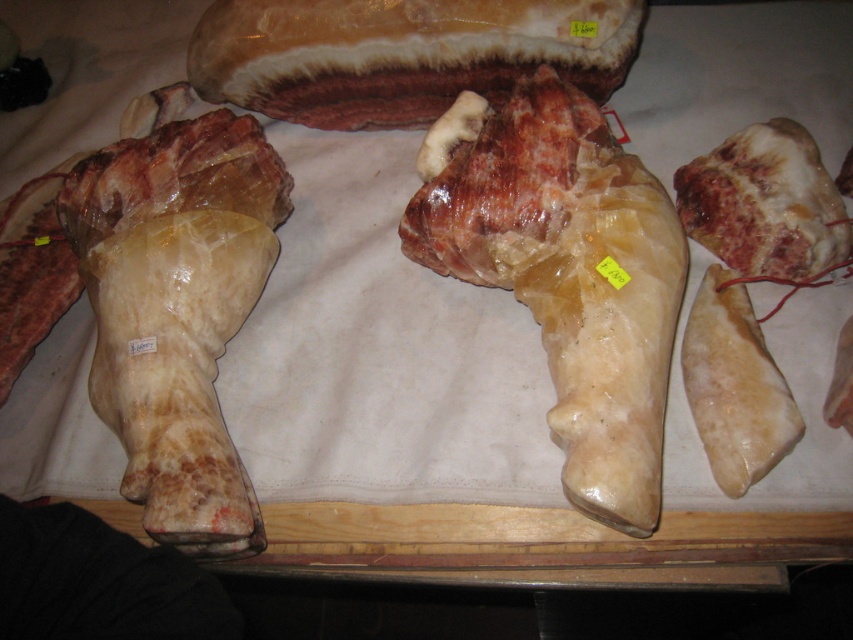
Who is lower down, fatty white meat at right or yellowish-fat ham at right?

yellowish-fat ham at right

Which is above, fatty white meat at right or yellowish-fat ham at right?

Positioned higher is fatty white meat at right.

In order to click on fatty white meat at right in this screenshot , I will do click(764, 204).

Between point (515, 234) and point (193, 77), which one is positioned in front?

Point (515, 234) is more forward.

From the picture: Does translucent gelatinous leg at center have a smaller size compared to glossy white meat at upper center?

Incorrect, translucent gelatinous leg at center is not smaller in size than glossy white meat at upper center.

Between point (444, 211) and point (480, 33), which one is positioned behind?

Point (480, 33)

Locate an element on the screen. The height and width of the screenshot is (640, 853). translucent gelatinous leg at center is located at coordinates (570, 278).

Is point (498, 115) less distant than point (752, 451)?

No.

Does translucent gelatinous leg at center have a lesser width compared to yellowish-fat ham at right?

In fact, translucent gelatinous leg at center might be wider than yellowish-fat ham at right.

Is point (612, 259) more distant than point (763, 474)?

That is True.

What are the coordinates of `translucent gelatinous leg at center` in the screenshot? It's located at (570, 278).